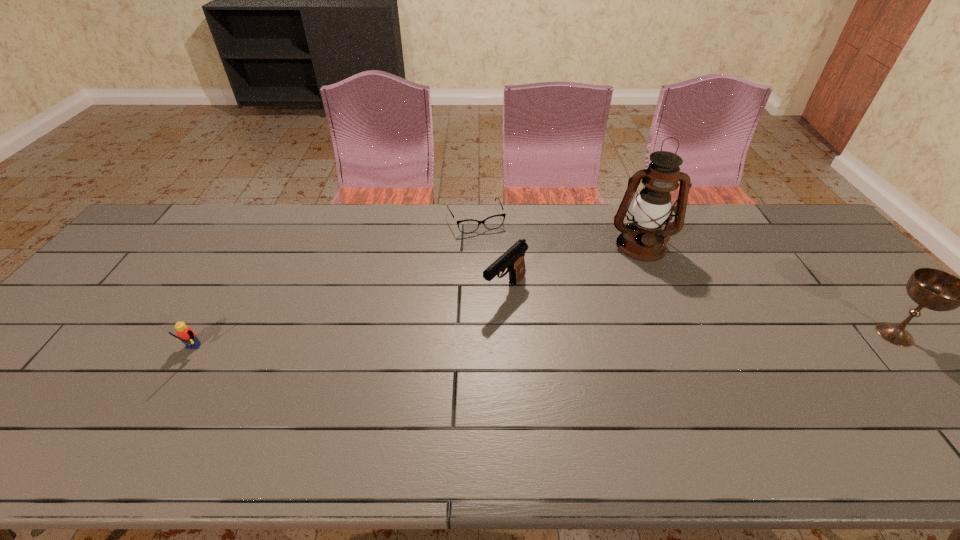
This screenshot has width=960, height=540. Identify the location of lantern that is at the far edge. (643, 239).

Where is `spectacles present at the far edge`? Image resolution: width=960 pixels, height=540 pixels. spectacles present at the far edge is located at coordinates (493, 222).

At what (x,y) coordinates should I click in order to perform the action: click on object at the right edge. Please return your answer as a coordinate pair (x, y). This screenshot has width=960, height=540. Looking at the image, I should click on (933, 289).

Image resolution: width=960 pixels, height=540 pixels. Find the location of `free region at the far edge of the desktop`. free region at the far edge of the desktop is located at coordinates (225, 232).

Find the location of a particular element. vacant area at the near edge of the desktop is located at coordinates (767, 411).

Where is `free space at the near left corner of the desktop`? Image resolution: width=960 pixels, height=540 pixels. free space at the near left corner of the desktop is located at coordinates (25, 406).

Where is `vacant space at the far right corner of the desktop`? The height and width of the screenshot is (540, 960). vacant space at the far right corner of the desktop is located at coordinates coord(791,222).

Locate an element on the screen. The height and width of the screenshot is (540, 960). vacant region between the spectacles and the rightmost object is located at coordinates (685, 277).

You are a GUI agent. You are given a task and a screenshot of the screen. Output one action in this format:
    pyautogui.click(x=<x>, y=<y>)
    Task: Click on the free space between the third shortest object and the fourth object from left to right
    
    Given the screenshot: What is the action you would take?
    pyautogui.click(x=573, y=268)

Find the location of a particular element. Image resolution: width=960 pixels, height=540 pixels. free space between the lantern and the leftmost object is located at coordinates click(416, 300).